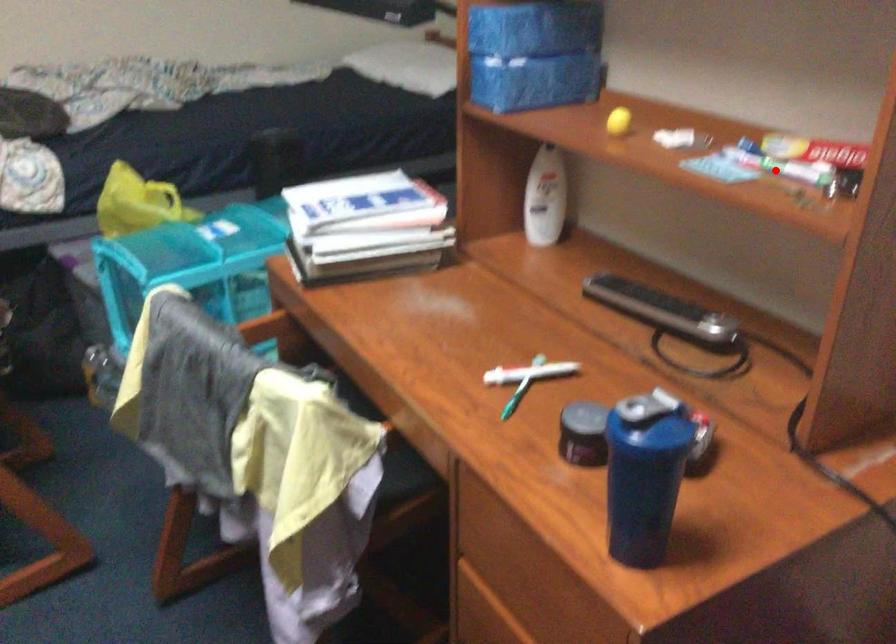
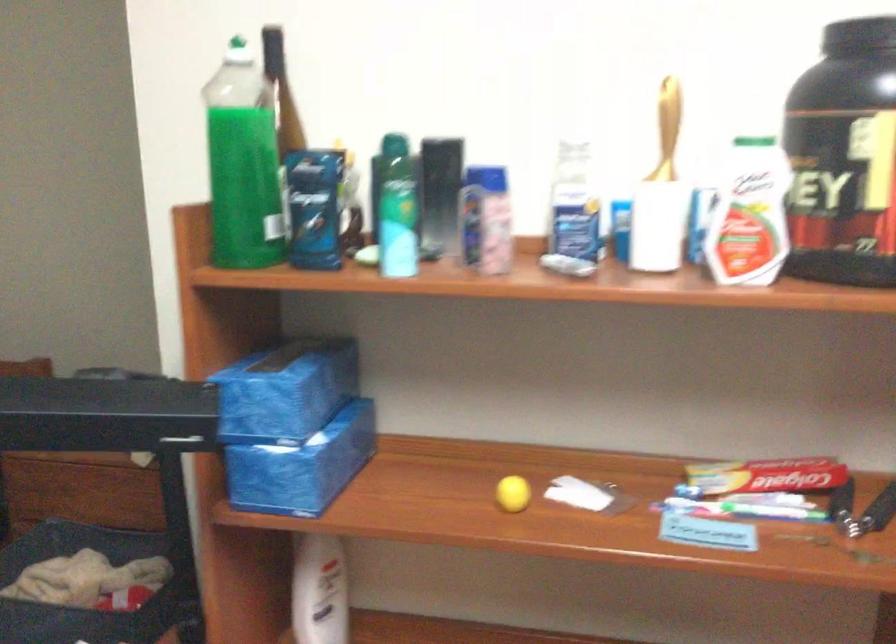
Question: I am providing you with two images of the same scene from different viewpoints. Given a red point in image1, look at the same physical point in image2. Is it:

Choices:
 (A) Closer to the viewpoint
 (B) Farther from the viewpoint

Answer: (A)